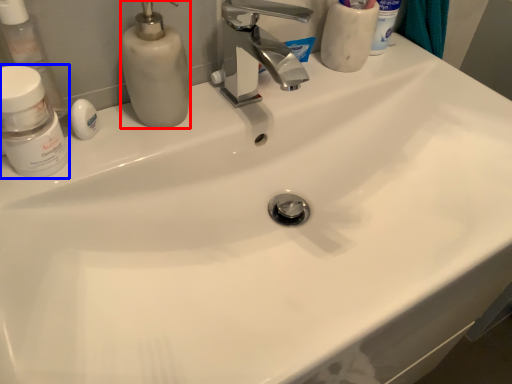
Question: Among these objects, which one is farthest to the camera, soap dispenser (highlighted by a red box) or mouthwash (highlighted by a blue box)?

Choices:
 (A) soap dispenser
 (B) mouthwash

Answer: (A)